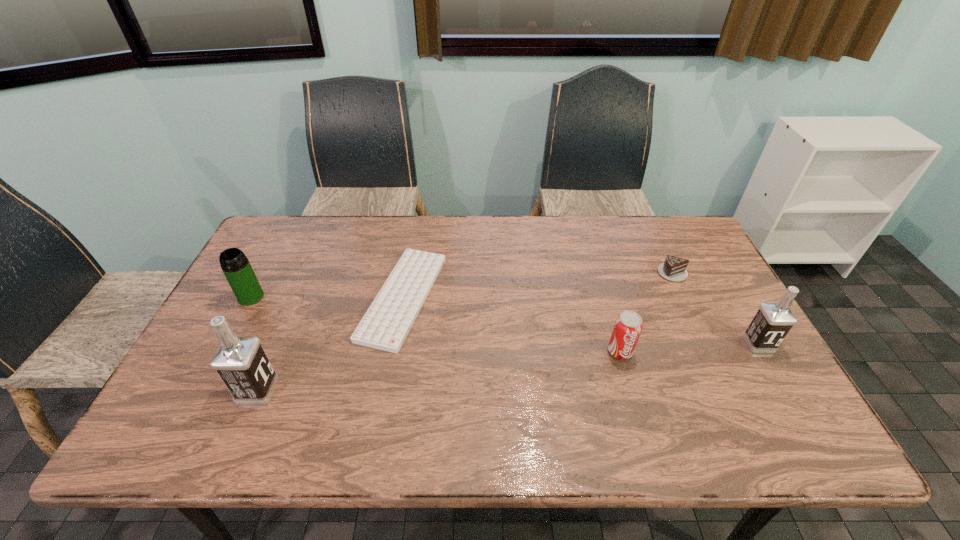
Find the location of a particular element. the tallest object is located at coordinates (240, 361).

At what (x,y) coordinates should I click in order to perform the action: click on the taller vodka. Please return your answer as a coordinate pair (x, y). This screenshot has width=960, height=540. Looking at the image, I should click on (240, 361).

Find the location of a particular element. the rightmost object is located at coordinates (772, 322).

This screenshot has height=540, width=960. What are the coordinates of `the farther vodka` in the screenshot? It's located at (772, 322).

The width and height of the screenshot is (960, 540). I want to click on computer keyboard, so click(385, 325).

Locate an element on the screen. This screenshot has width=960, height=540. the shortest object is located at coordinates (385, 325).

In order to click on the leftmost object in this screenshot , I will do `click(236, 267)`.

Where is `soda can`? soda can is located at coordinates (628, 326).

Identify the location of the third shortest object. (628, 326).

At what (x,y) coordinates should I click in order to perform the action: click on the second shortest object. Please return your answer as a coordinate pair (x, y). Looking at the image, I should click on (674, 269).